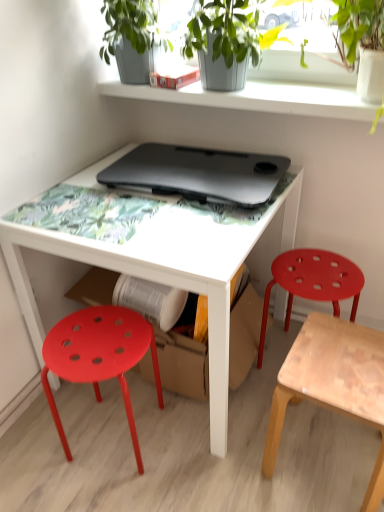
This screenshot has width=384, height=512. I want to click on free space in front of matte plastic stool at lower left, which ranks as the 3th stool in right-to-left order, so click(x=107, y=493).